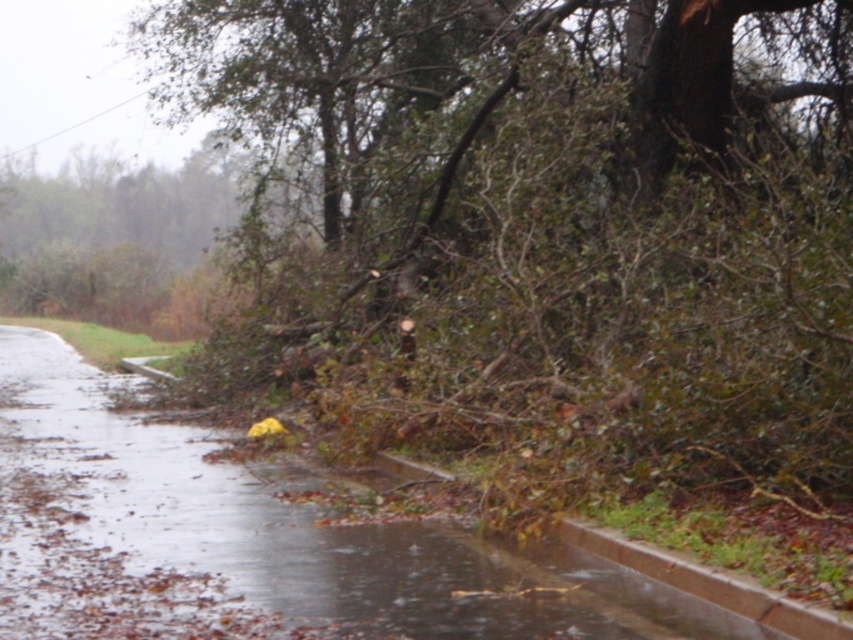
Question: Does brown rough tree at center have a larger size compared to brown concrete curb at lower right?

Choices:
 (A) yes
 (B) no

Answer: (A)

Question: Which of the following is the farthest from the observer?

Choices:
 (A) (618, 602)
 (B) (764, 609)

Answer: (A)

Question: Which of these objects is positioned farthest from the brown concrete curb at lower right?

Choices:
 (A) wet concrete flood at lower left
 (B) brown rough tree at center

Answer: (B)

Question: Can you confirm if wet concrete flood at lower left is positioned above brown concrete curb at lower right?

Choices:
 (A) yes
 (B) no

Answer: (A)

Question: Does brown rough tree at center have a greater width compared to brown concrete curb at lower right?

Choices:
 (A) no
 (B) yes

Answer: (B)

Question: Which point is farther to the camera?

Choices:
 (A) brown concrete curb at lower right
 (B) brown rough tree at center

Answer: (B)